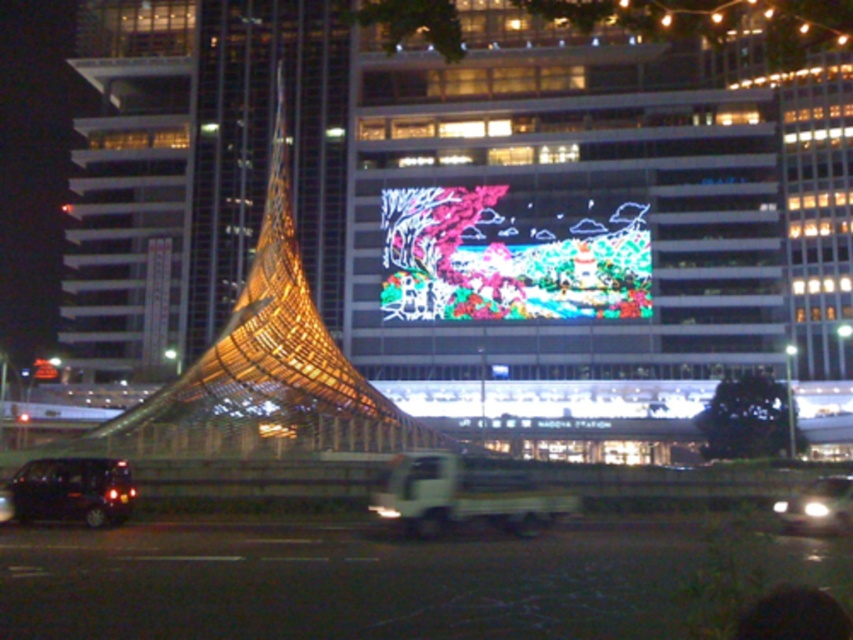
You are standing in the middle of the urban night scene and see the glassy reflective tower at left represented by point (131, 189). If you want to take a photo of the tower without any reflections from the billboard, where should you position yourself relative to the tower?

To avoid reflections from the billboard, you should position yourself behind the glassy reflective tower at left represented by point (131, 189) so that the tower is between you and the billboard.

You are standing in the urban night scene and see the point marked at coordinates (131, 189). What does this point represent?

The point at (131, 189) indicates the glassy reflective tower at left.

You are driving a shiny black car at lower left and want to turn right onto a side street that is behind the glassy reflective tower at left. Can you see the turn clearly from your current position?

The shiny black car at lower left is behind the glassy reflective tower at left, so the driver cannot see the turn clearly as the tower may block the view.